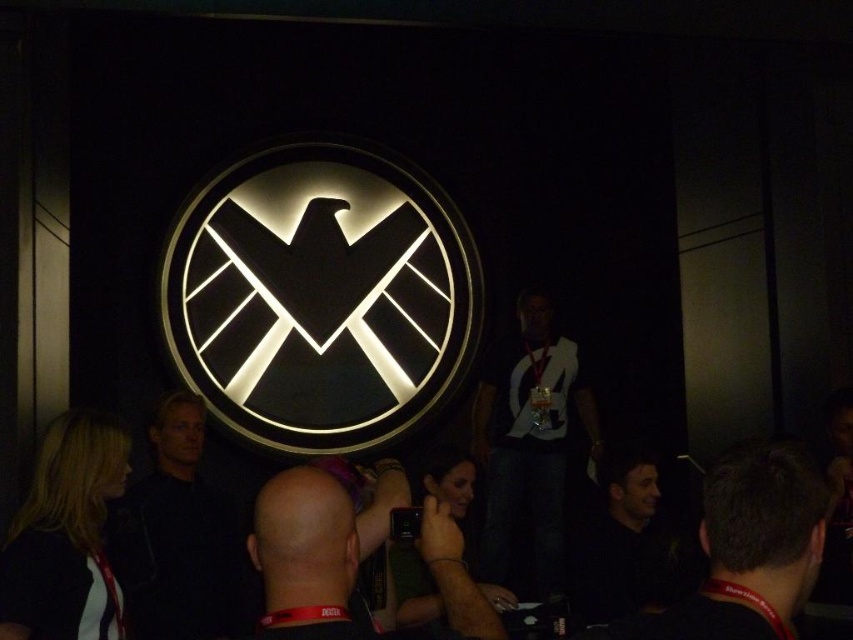
Does black matte logo at center have a lesser height compared to dark gray shirt at center?

In fact, black matte logo at center may be taller than dark gray shirt at center.

Based on the photo, is black matte logo at center positioned at the back of dark gray shirt at center?

Yes, it is.

Find the location of a particular element. This screenshot has height=640, width=853. black matte logo at center is located at coordinates (320, 296).

Between point (821, 497) and point (643, 472), which one is positioned behind?

The point (643, 472) is behind.

Between point (816, 564) and point (639, 536), which one is positioned in front?

Point (816, 564) is more forward.

The image size is (853, 640). I want to click on black matte hair at lower right, so click(753, 545).

Is bald head at center taller than dark gray shirt at center?

No, bald head at center is not taller than dark gray shirt at center.

Who is shorter, bald head at center or dark gray shirt at center?

Standing shorter between the two is bald head at center.

At what (x,y) coordinates should I click in order to perform the action: click on bald head at center. Please return your answer as a coordinate pair (x, y). This screenshot has height=640, width=853. Looking at the image, I should click on (306, 556).